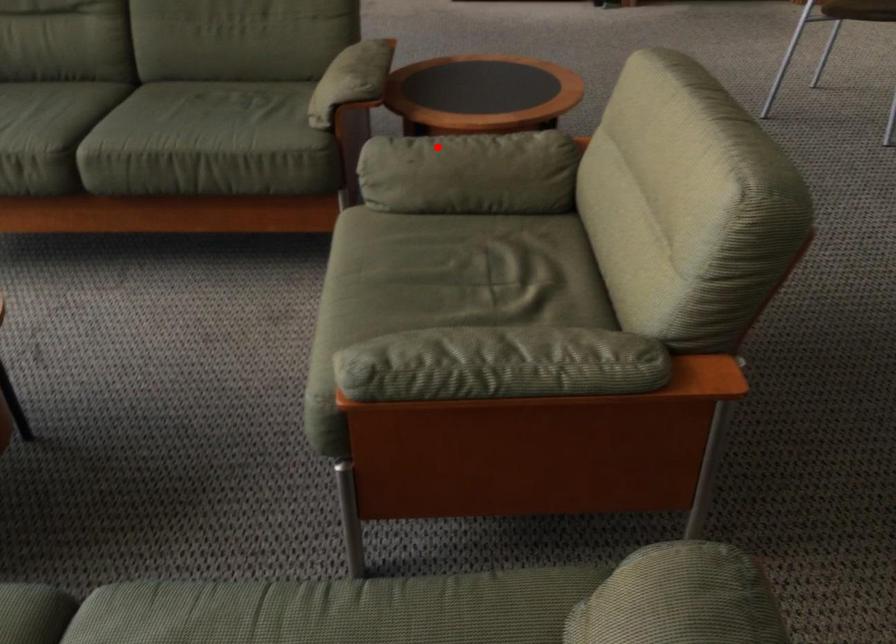
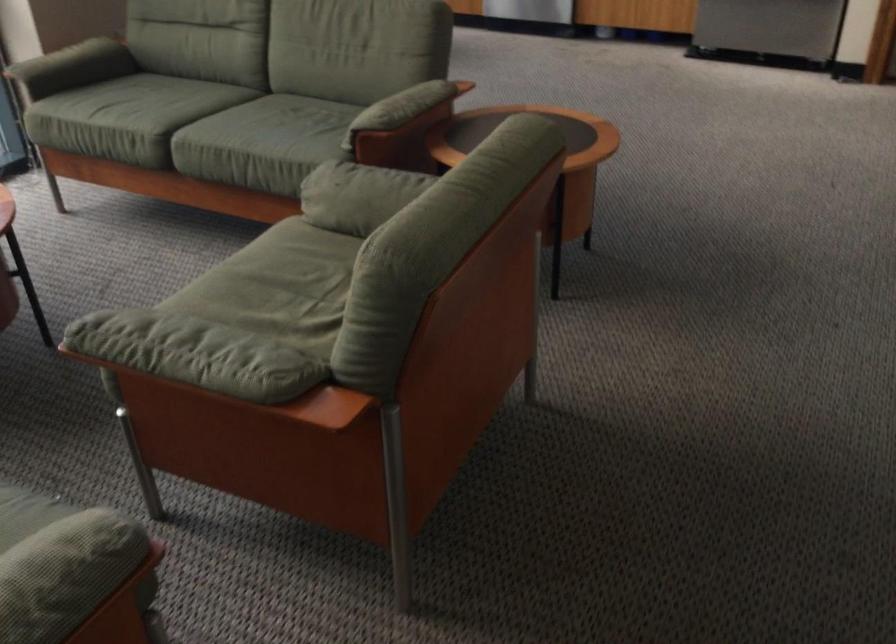
Find the pixel in the second image that matches the highlighted location in the first image.

(364, 176)